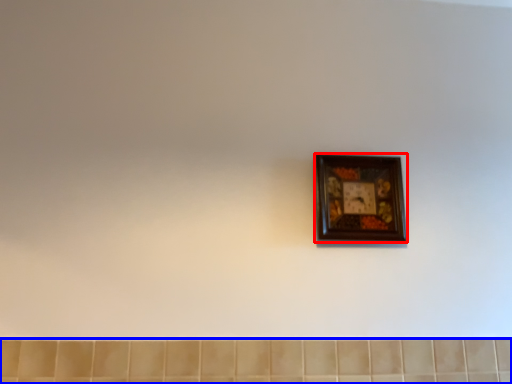
Question: Which point is closer to the camera, picture frame (highlighted by a red box) or ceramic tile (highlighted by a blue box)?

Choices:
 (A) picture frame
 (B) ceramic tile

Answer: (B)